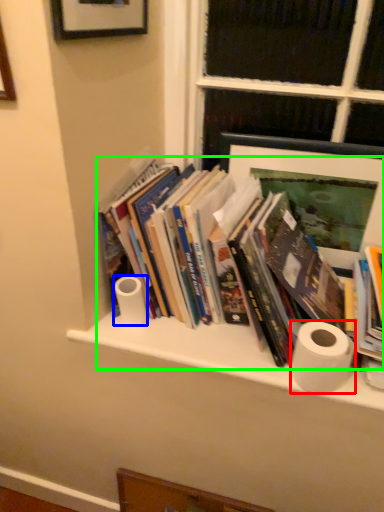
Question: Estimate the real-world distances between objects in this image. Which object is closer to toilet paper (highlighted by a red box), toilet paper (highlighted by a blue box) or book (highlighted by a green box)?

Choices:
 (A) toilet paper
 (B) book

Answer: (B)